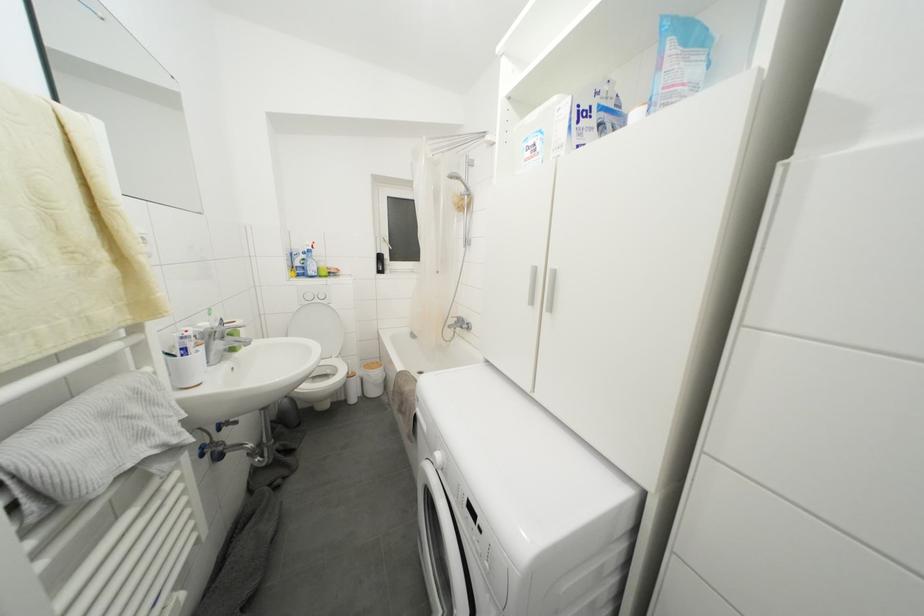
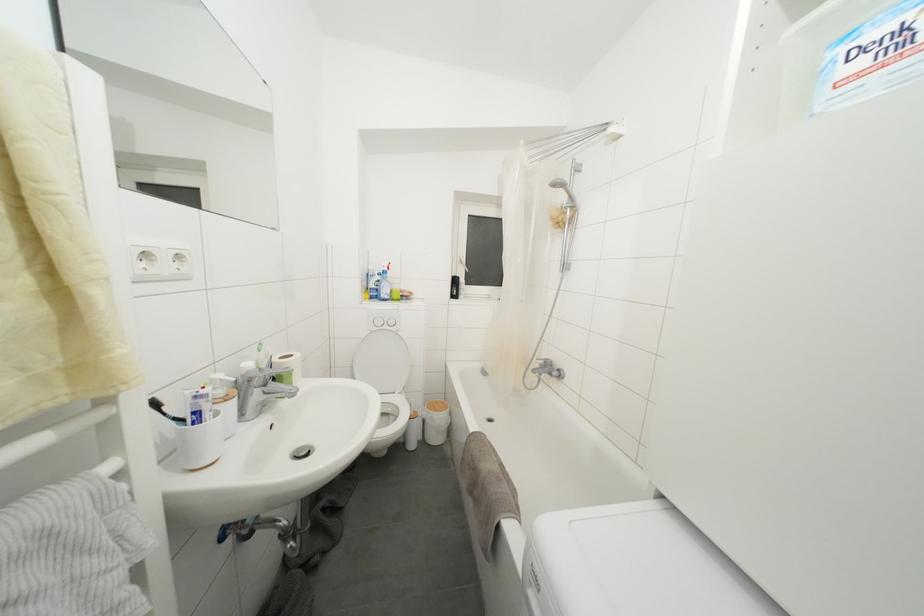
Where in the second image is the point corresponding to (196,355) from the first image?

(211, 419)